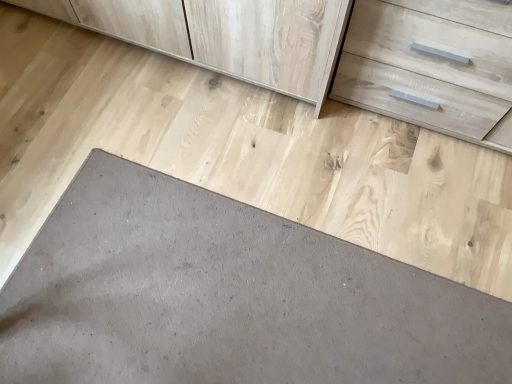
Question: Can you confirm if light wood drawer at upper right is positioned to the left of gray matte slate at lower left?

Choices:
 (A) yes
 (B) no

Answer: (B)

Question: Is light wood drawer at upper right next to gray matte slate at lower left?

Choices:
 (A) yes
 (B) no

Answer: (B)

Question: Does light wood drawer at upper right contain gray matte slate at lower left?

Choices:
 (A) no
 (B) yes

Answer: (A)

Question: From a real-world perspective, does light wood drawer at upper right sit lower than gray matte slate at lower left?

Choices:
 (A) no
 (B) yes

Answer: (A)

Question: From the image's perspective, is light wood drawer at upper right located above gray matte slate at lower left?

Choices:
 (A) no
 (B) yes

Answer: (B)

Question: From a real-world perspective, is light wood drawer at upper right on gray matte slate at lower left?

Choices:
 (A) yes
 (B) no

Answer: (A)

Question: From the image's perspective, does gray matte slate at lower left appear higher than light wood drawer at upper right?

Choices:
 (A) yes
 (B) no

Answer: (B)

Question: Does gray matte slate at lower left have a lesser height compared to light wood drawer at upper right?

Choices:
 (A) no
 (B) yes

Answer: (B)

Question: Is gray matte slate at lower left behind light wood drawer at upper right?

Choices:
 (A) no
 (B) yes

Answer: (B)

Question: From a real-world perspective, is gray matte slate at lower left located higher than light wood drawer at upper right?

Choices:
 (A) no
 (B) yes

Answer: (A)

Question: Does gray matte slate at lower left have a smaller size compared to light wood drawer at upper right?

Choices:
 (A) yes
 (B) no

Answer: (A)

Question: Does gray matte slate at lower left contain light wood drawer at upper right?

Choices:
 (A) yes
 (B) no

Answer: (B)

Question: Would you say light wood drawer at upper right is to the left or to the right of gray matte slate at lower left in the picture?

Choices:
 (A) left
 (B) right

Answer: (B)